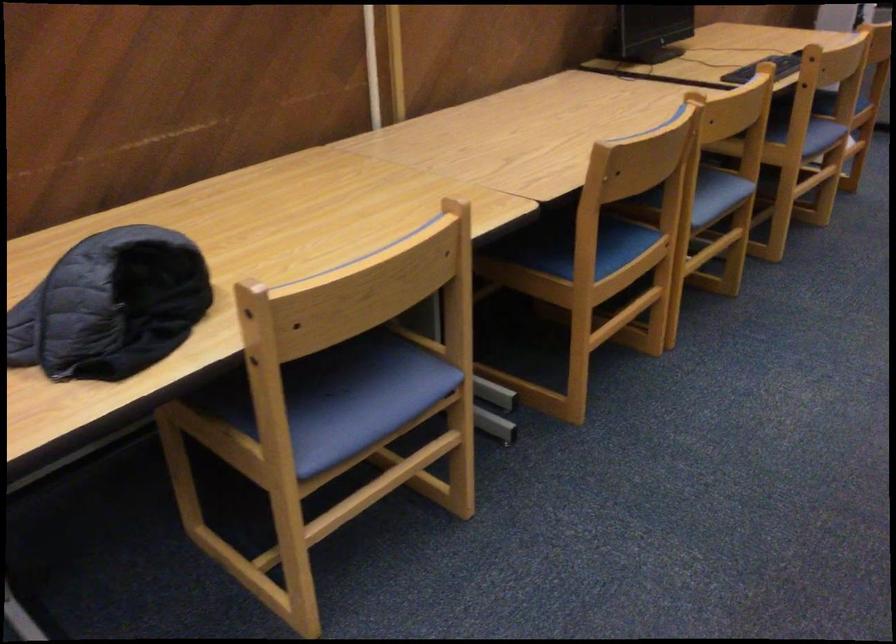
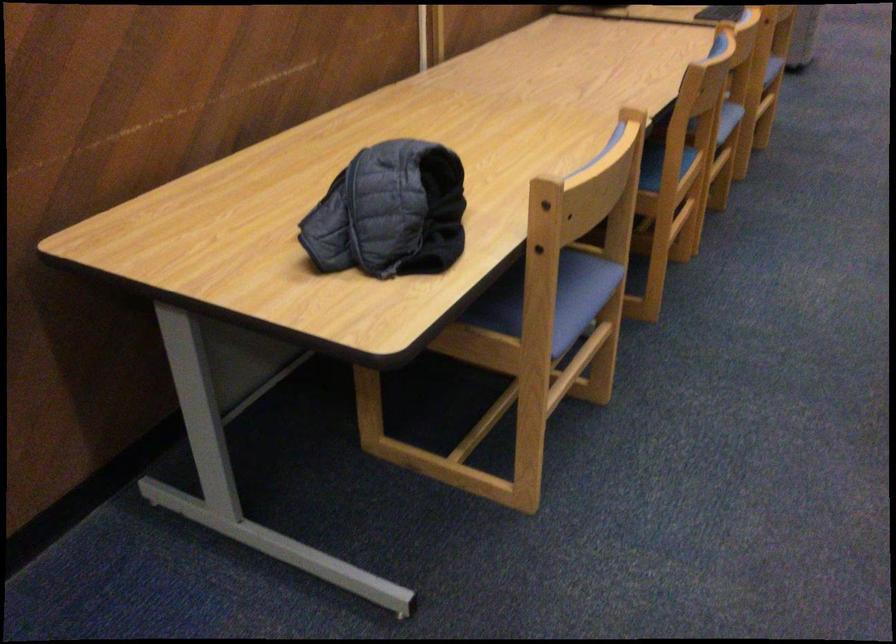
Where in the second image is the point corresponding to (x=728, y=194) from the first image?

(728, 118)